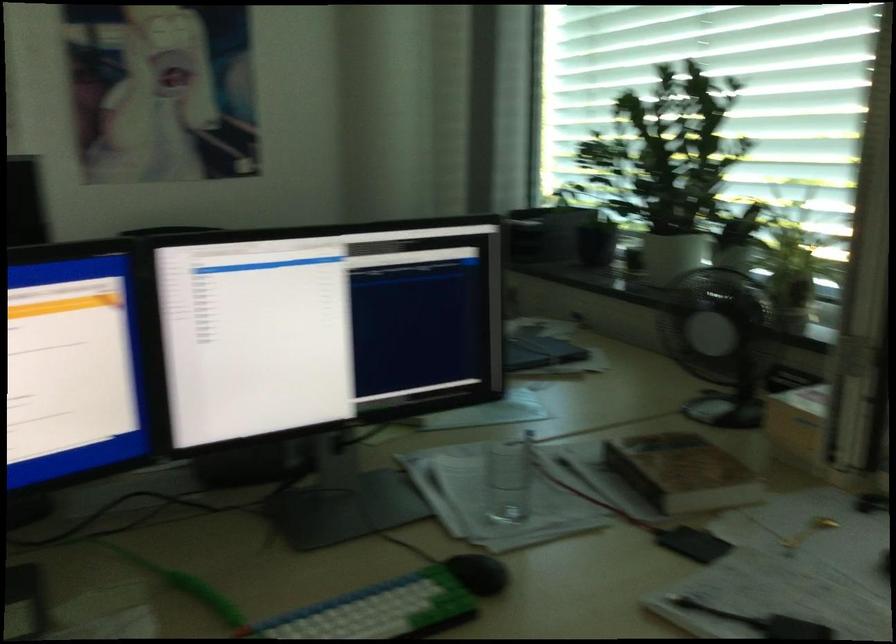
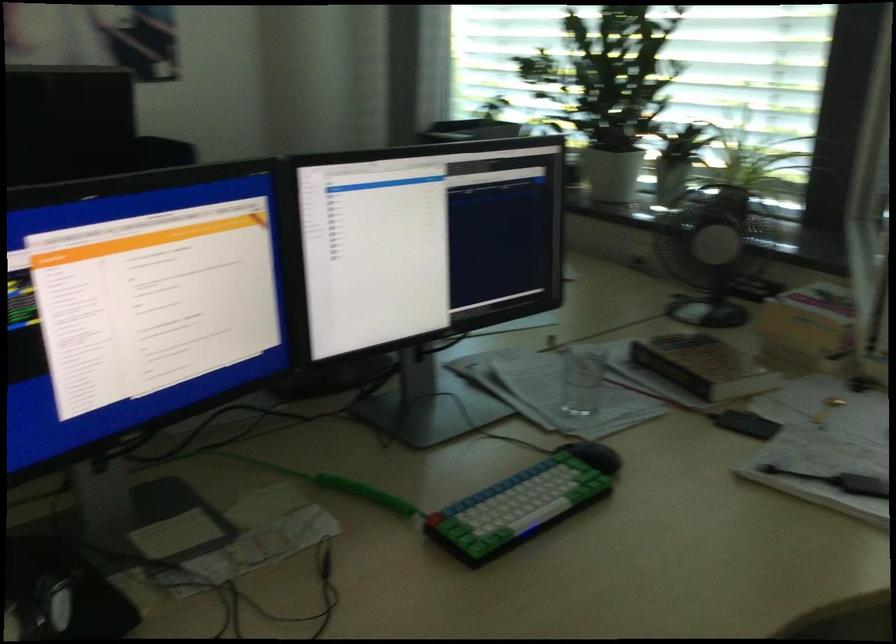
In the second image, find the point that corresponds to the point at 655,257 in the first image.

(612, 174)